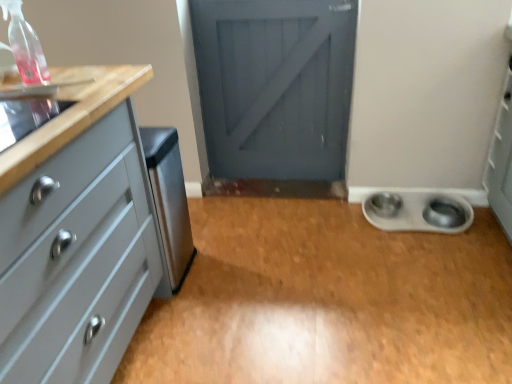
This screenshot has width=512, height=384. Identify the location of vacant space situated on the left part of silver metallic bowls at lower right, acting as the second appliance starting from the left. (341, 230).